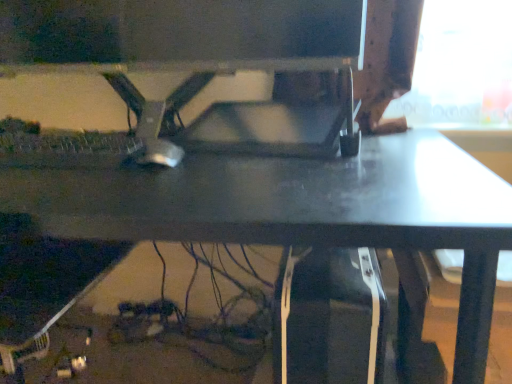
In order to face silver metallic mouse at center, should I rotate leftwards or rightwards?

A 11.995 degree turn to the left will do.

This screenshot has height=384, width=512. I want to click on matte black monitor at center, so click(x=181, y=34).

From their relative heights in the image, would you say matte black monitor at center is taller or shorter than silver metallic mouse at center?

Clearly, matte black monitor at center is taller compared to silver metallic mouse at center.

From a real-world perspective, which is physically below, matte black monitor at center or silver metallic mouse at center?

silver metallic mouse at center is physically lower.

From the image's perspective, who appears lower, matte black monitor at center or silver metallic mouse at center?

From the image's view, silver metallic mouse at center is below.

Would you consider matte black monitor at center to be distant from silver metallic mouse at center?

No.

From a real-world perspective, which object stands above the other?

From a 3D spatial view, matte black monitor at center is above.

From the image's perspective, which one is positioned higher, silver metallic mouse at center or matte black monitor at center?

matte black monitor at center is shown above in the image.

Is silver metallic mouse at center taller than matte black monitor at center?

In fact, silver metallic mouse at center may be shorter than matte black monitor at center.

Can you tell me how much silver metallic mouse at center and matte black monitor at center differ in facing direction?

The angular difference between silver metallic mouse at center and matte black monitor at center is 23.2 degrees.

Could you tell me if matte black monitor at center is turned towards matte black desk at center?

No, matte black monitor at center does not turn towards matte black desk at center.

Can you confirm if matte black monitor at center is thinner than matte black desk at center?

Yes.

Between matte black monitor at center and matte black desk at center, which one appears on the right side from the viewer's perspective?

matte black monitor at center is more to the right.

Is matte black desk at center with silver metallic mouse at center?

matte black desk at center and silver metallic mouse at center are clearly separated.

Is matte black desk at center shorter than silver metallic mouse at center?

In fact, matte black desk at center may be taller than silver metallic mouse at center.

From a real-world perspective, who is located lower, matte black desk at center or silver metallic mouse at center?

matte black desk at center is physically lower.

In the scene shown: Is matte black desk at center placed right next to matte black monitor at center?

No, matte black desk at center is not in contact with matte black monitor at center.

Which object is wider, matte black desk at center or matte black monitor at center?

Wider between the two is matte black desk at center.

Can you confirm if matte black desk at center is smaller than matte black monitor at center?

No.

What's the angular difference between silver metallic mouse at center and matte black desk at center's facing directions?

3.03 degrees.

Is silver metallic mouse at center oriented towards matte black desk at center?

No, silver metallic mouse at center is not oriented towards matte black desk at center.

Considering the positions of points (176, 148) and (75, 174), is point (176, 148) farther from camera compared to point (75, 174)?

That is True.

Which object is more forward, silver metallic mouse at center or matte black desk at center?

Positioned in front is matte black desk at center.

Image resolution: width=512 pixels, height=384 pixels. In order to click on computer monitor in front of the silver metallic mouse at center in this screenshot , I will do `click(181, 34)`.

The image size is (512, 384). Find the location of `mouse lying behind the matte black monitor at center`. mouse lying behind the matte black monitor at center is located at coordinates (159, 153).

Based on their spatial positions, is matte black desk at center or matte black monitor at center further from silver metallic mouse at center?

matte black monitor at center lies further to silver metallic mouse at center than the other object.

From the image, which object appears to be nearer to matte black desk at center, silver metallic mouse at center or matte black monitor at center?

silver metallic mouse at center is closer to matte black desk at center.

Estimate the real-world distances between objects in this image. Which object is closer to matte black monitor at center, matte black desk at center or silver metallic mouse at center?

silver metallic mouse at center.

Estimate the real-world distances between objects in this image. Which object is further from silver metallic mouse at center, matte black monitor at center or matte black desk at center?

matte black monitor at center is positioned further to the anchor silver metallic mouse at center.

From the picture: From the image, which object appears to be nearer to matte black desk at center, matte black monitor at center or silver metallic mouse at center?

The object closer to matte black desk at center is silver metallic mouse at center.

Estimate the real-world distances between objects in this image. Which object is closer to matte black monitor at center, silver metallic mouse at center or matte black desk at center?

silver metallic mouse at center.

Where is `mouse that lies between matte black monitor at center and matte black desk at center from top to bottom`? Image resolution: width=512 pixels, height=384 pixels. mouse that lies between matte black monitor at center and matte black desk at center from top to bottom is located at coordinates (159, 153).